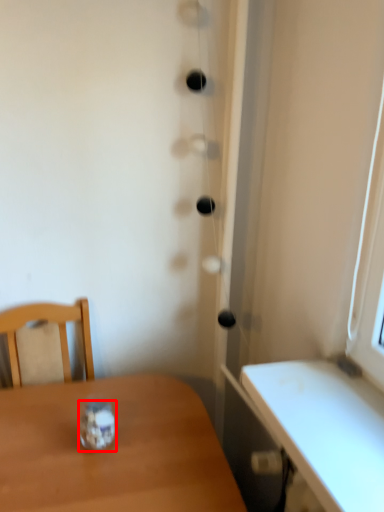
Question: From the image's perspective, what is the correct spatial positioning of glass jar (annotated by the red box) in reference to table?

Choices:
 (A) below
 (B) above

Answer: (B)